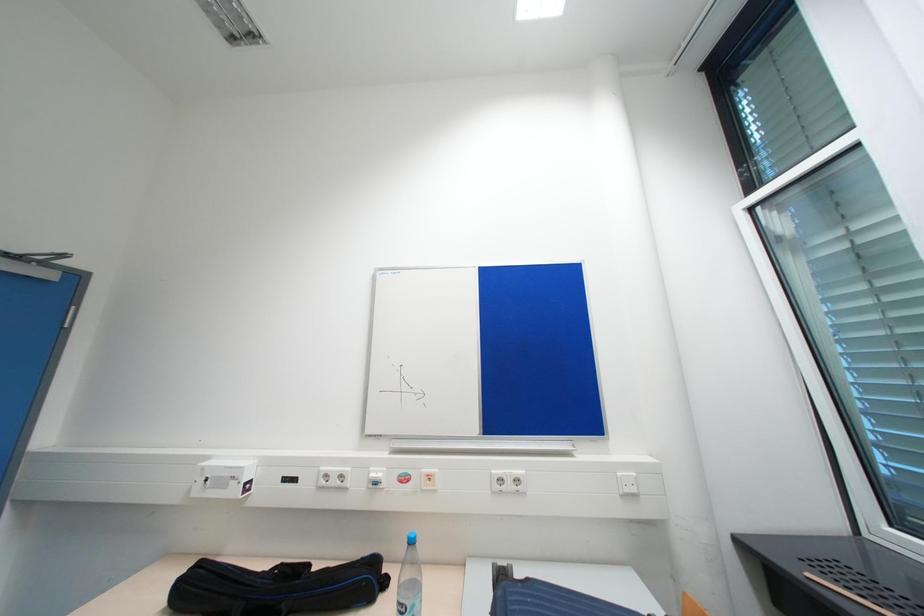
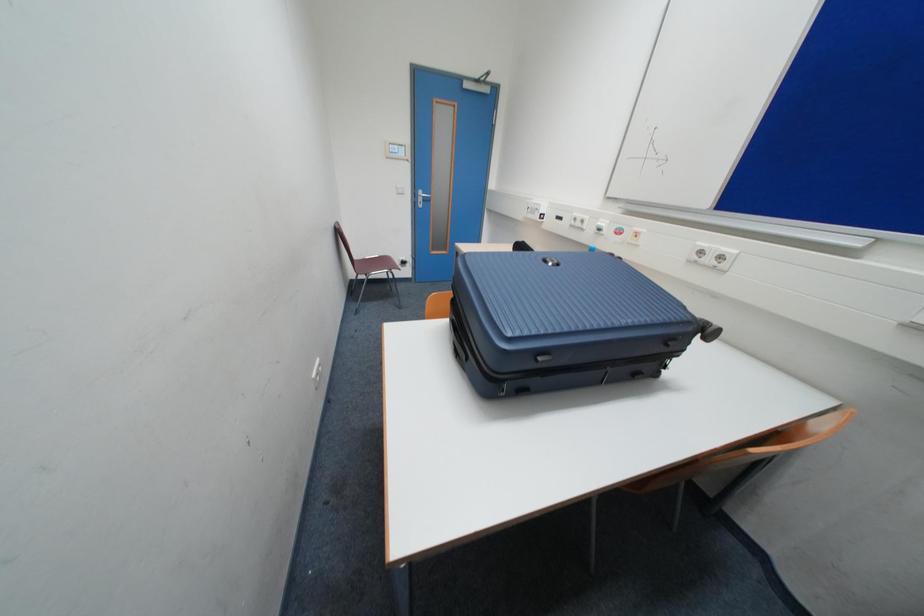
First-person continuous shooting, in which direction is the camera rotating?

The camera rotated toward left-down.